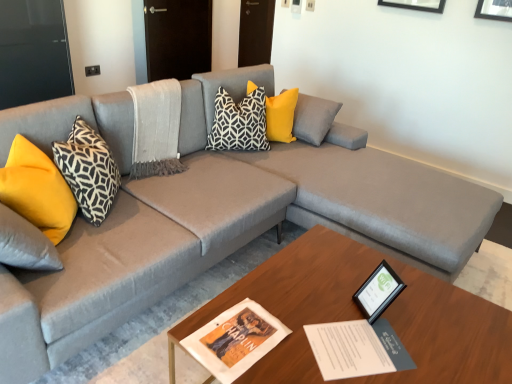
Question: Is the position of wooden coffee table at center more distant than that of yellow fabric pillow at center, the 4th pillow viewed from the left?

Choices:
 (A) yes
 (B) no

Answer: (B)

Question: Is there a large distance between wooden coffee table at center and yellow fabric pillow at center, placed as the first pillow when sorted from right to left?

Choices:
 (A) yes
 (B) no

Answer: (A)

Question: Is wooden coffee table at center to the left of yellow fabric pillow at center, the 4th pillow viewed from the left, from the viewer's perspective?

Choices:
 (A) no
 (B) yes

Answer: (A)

Question: From the image's perspective, is wooden coffee table at center under yellow fabric pillow at center, placed as the first pillow when sorted from right to left?

Choices:
 (A) no
 (B) yes

Answer: (B)

Question: Does wooden coffee table at center turn towards yellow fabric pillow at center, placed as the first pillow when sorted from right to left?

Choices:
 (A) yes
 (B) no

Answer: (B)

Question: From the image's perspective, is wooden coffee table at center on yellow fabric pillow at center, placed as the first pillow when sorted from right to left?

Choices:
 (A) yes
 (B) no

Answer: (B)

Question: Can you confirm if yellow fabric pillow at center, the 4th pillow viewed from the left, is positioned to the left of black glossy picture frame at lower right?

Choices:
 (A) yes
 (B) no

Answer: (A)

Question: Is yellow fabric pillow at center, the 4th pillow viewed from the left, turned away from black glossy picture frame at lower right?

Choices:
 (A) no
 (B) yes

Answer: (A)

Question: Does yellow fabric pillow at center, the 4th pillow viewed from the left, touch black glossy picture frame at lower right?

Choices:
 (A) no
 (B) yes

Answer: (A)

Question: Is yellow fabric pillow at center, placed as the first pillow when sorted from right to left, smaller than black glossy picture frame at lower right?

Choices:
 (A) no
 (B) yes

Answer: (A)

Question: Does yellow fabric pillow at center, placed as the first pillow when sorted from right to left, appear on the right side of black glossy picture frame at lower right?

Choices:
 (A) yes
 (B) no

Answer: (B)

Question: From a real-world perspective, is yellow fabric pillow at center, placed as the first pillow when sorted from right to left, under black glossy picture frame at lower right?

Choices:
 (A) no
 (B) yes

Answer: (A)

Question: Does black and white geometric pillow at center, the second pillow viewed from the right, have a lesser width compared to yellow fabric pillow at center, placed as the first pillow when sorted from right to left?

Choices:
 (A) yes
 (B) no

Answer: (A)